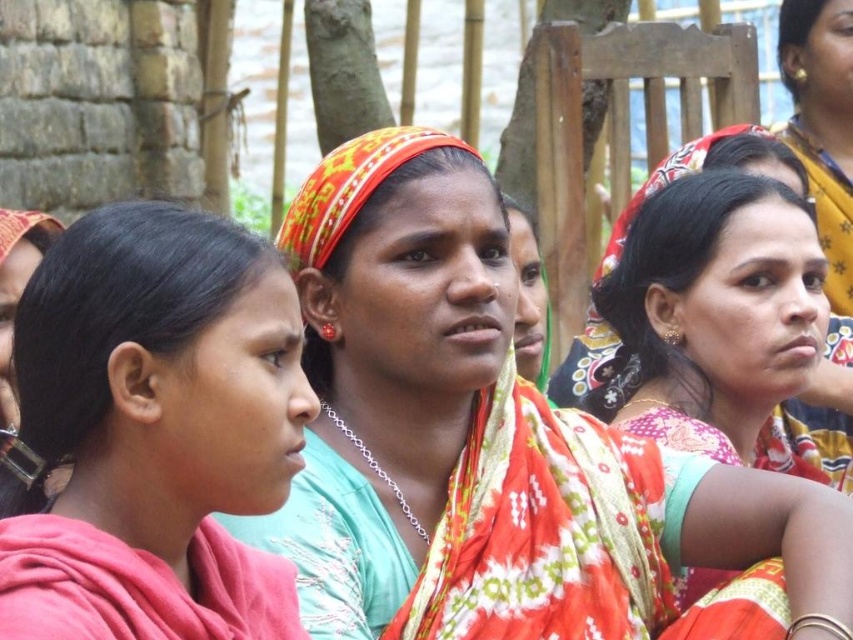
Based on the photo, you are a photographer trying to capture the central figures in this image. Which object, the floral silk saree at center or the matte orange scarf at center, is positioned to the right of the other?

The floral silk saree at center is to the right of the matte orange scarf at center.

You are standing 20 meters away from a point at coordinates point (x=126, y=225). Can you reach the point without moving closer than 25 meters?

The point (x=126, y=225) is 30.92 meters from the viewer. Since you are currently 20 meters away, you need to move an additional 10.92 meters towards it to reach the point. However, moving closer than 25 meters would require moving to within 25 meters, but since the point is at 30.92 meters, you can reach it without violating the 25 meters minimum distance. Therefore, yes, you can reach the point without moving closer than 25 meters.